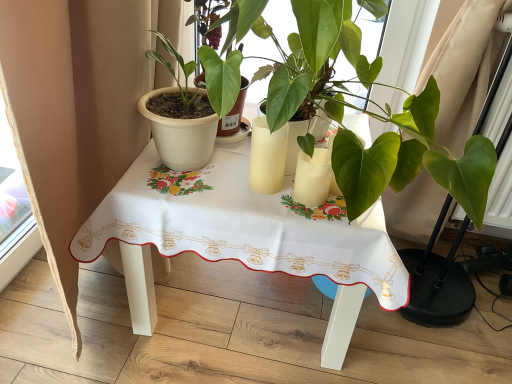
This screenshot has width=512, height=384. Find the location of `free location to the left of matte white candle at center, the second candle holder in the left-to-right sequence`. free location to the left of matte white candle at center, the second candle holder in the left-to-right sequence is located at coordinates (234, 187).